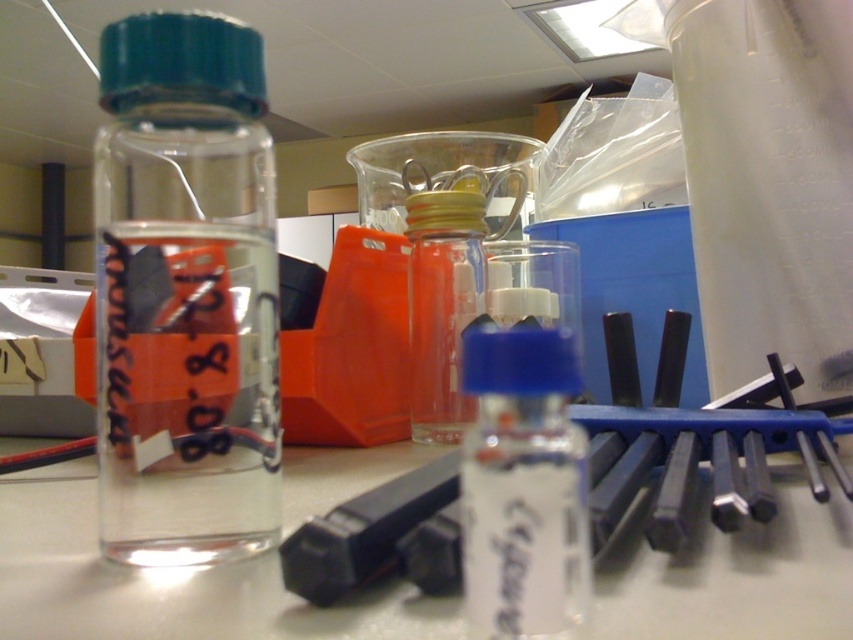
Who is lower down, transparent plastic vial at center or transparent glass bottle at center?

transparent plastic vial at center is below.

Is transparent plastic vial at center further to the viewer compared to transparent glass bottle at center?

No.

Is point (526, 385) positioned before point (454, 433)?

Yes, it is.

Where is `transparent plastic vial at center`? Image resolution: width=853 pixels, height=640 pixels. transparent plastic vial at center is located at coordinates (523, 486).

Does transparent glass table at center appear over transparent plastic vial at center?

No.

The height and width of the screenshot is (640, 853). What do you see at coordinates (166, 582) in the screenshot? I see `transparent glass table at center` at bounding box center [166, 582].

Between point (169, 616) and point (503, 467), which one is positioned in front?

Positioned in front is point (503, 467).

This screenshot has height=640, width=853. I want to click on transparent glass table at center, so click(166, 582).

Which is in front, point (160, 268) or point (519, 579)?

Point (519, 579) is more forward.

Is point (152, 224) closer to camera compared to point (579, 616)?

No, it is behind (579, 616).

You are a GUI agent. You are given a task and a screenshot of the screen. Output one action in this format:
    pyautogui.click(x=<x>, y=<y>)
    Task: Click on the transparent glass bottle at left
    The image size is (853, 640).
    Given the screenshot: What is the action you would take?
    pyautogui.click(x=184, y=292)